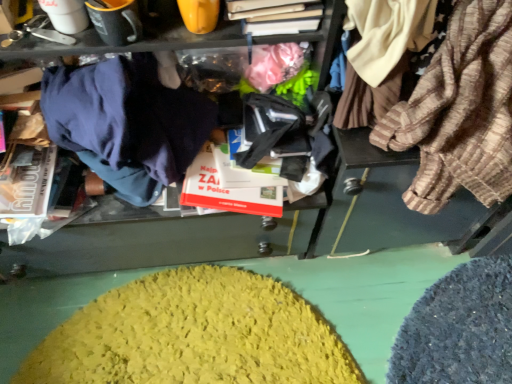
Question: Considering the positions of dark blue fabric at left, the second clothing positioned from the right, and yellow fuzzy rug at lower center in the image, is dark blue fabric at left, the second clothing positioned from the right, wider or thinner than yellow fuzzy rug at lower center?

Choices:
 (A) wide
 (B) thin

Answer: (B)

Question: Is point (118, 119) positioned closer to the camera than point (196, 362)?

Choices:
 (A) farther
 (B) closer

Answer: (B)

Question: Considering the real-world distances, which object is closest to the yellow fuzzy rug at lower center?

Choices:
 (A) striped cotton shirt at right, which appears as the second clothing when viewed from the left
 (B) dark blue fabric at left, the first clothing viewed from the left
 (C) matte white coffee cup at upper left

Answer: (B)

Question: Which object is positioned farthest from the striped cotton shirt at right, the 1th clothing when ordered from right to left?

Choices:
 (A) matte white coffee cup at upper left
 (B) yellow fuzzy rug at lower center
 (C) dark blue fabric at left, the second clothing positioned from the right

Answer: (A)